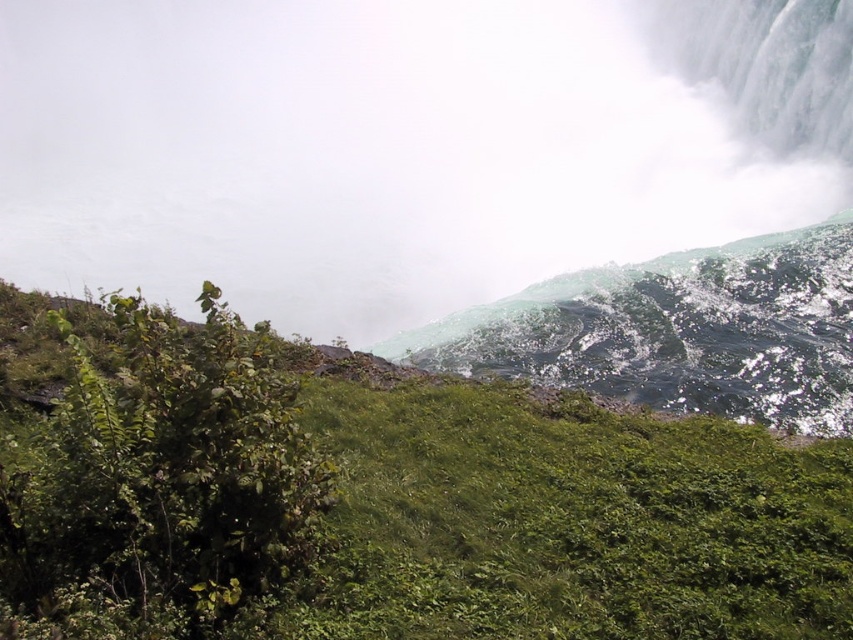
Is green grassy hillside at center above white misty fog at upper center?

No.

Does green grassy hillside at center appear on the left side of white misty fog at upper center?

In fact, green grassy hillside at center is to the right of white misty fog at upper center.

Find the location of a particular element. The height and width of the screenshot is (640, 853). green grassy hillside at center is located at coordinates (392, 502).